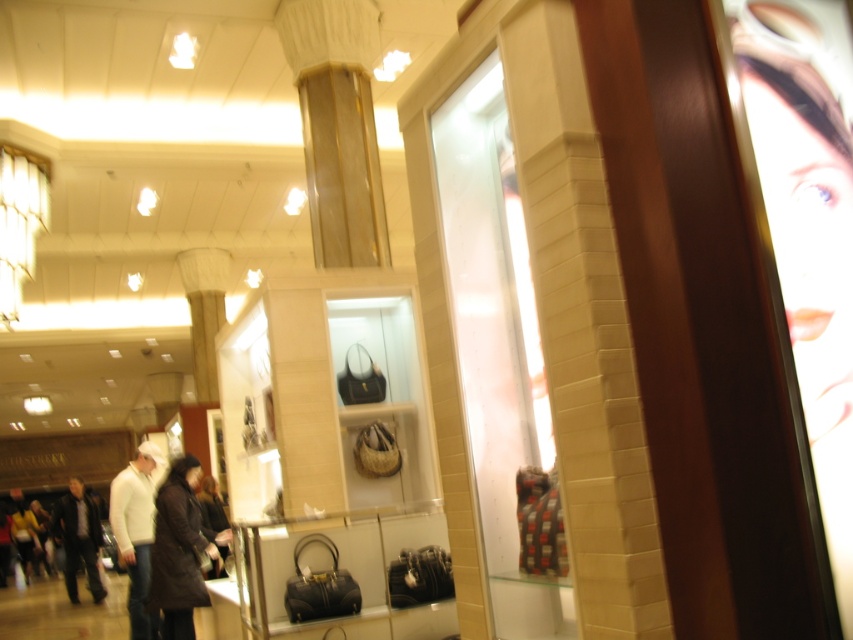
Between dark brown leather jacket at center and dark brown leather jacket at lower left, which one appears on the right side from the viewer's perspective?

Positioned to the right is dark brown leather jacket at center.

Between point (186, 484) and point (91, 522), which one is positioned in front?

Point (186, 484) is more forward.

I want to click on dark brown leather jacket at center, so click(178, 550).